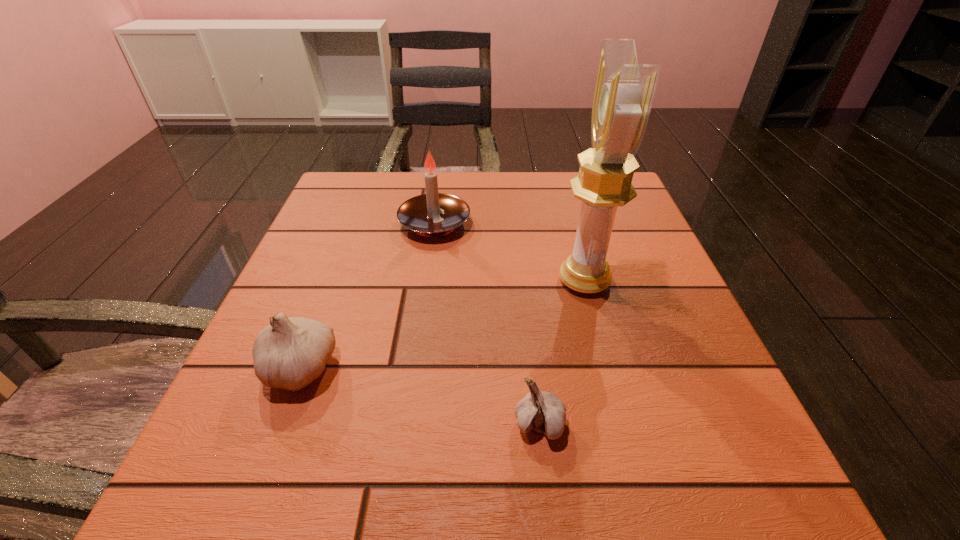
Where is `vacant space at the left edge`? This screenshot has width=960, height=540. vacant space at the left edge is located at coordinates (315, 268).

You are a GUI agent. You are given a task and a screenshot of the screen. Output one action in this format:
    pyautogui.click(x=<x>, y=<y>)
    Task: Click on the free location at the right edge of the desktop
    Image resolution: width=960 pixels, height=540 pixels.
    Given the screenshot: What is the action you would take?
    pyautogui.click(x=640, y=377)

Where is `vacant region at the far left corner`? Image resolution: width=960 pixels, height=540 pixels. vacant region at the far left corner is located at coordinates (371, 193).

Identify the location of vacant space at the near left corner of the desktop. The height and width of the screenshot is (540, 960). (306, 516).

This screenshot has width=960, height=540. In the image, there is a desktop. Find the location of `free space at the near right corner`. free space at the near right corner is located at coordinates (765, 455).

The image size is (960, 540). Find the location of `unoccupied area between the farther garlic and the third shortest object`. unoccupied area between the farther garlic and the third shortest object is located at coordinates pos(367,295).

Find the location of a particular element. The image size is (960, 540). free space between the nearer garlic and the third shortest object is located at coordinates (487, 324).

This screenshot has height=540, width=960. What are the coordinates of `free space between the candle and the third farthest object` in the screenshot? It's located at (367, 295).

Image resolution: width=960 pixels, height=540 pixels. In order to click on free space that is in between the second farthest object and the taller garlic in this screenshot , I will do `click(442, 324)`.

The width and height of the screenshot is (960, 540). I want to click on free space between the candle and the third farthest object, so click(367, 295).